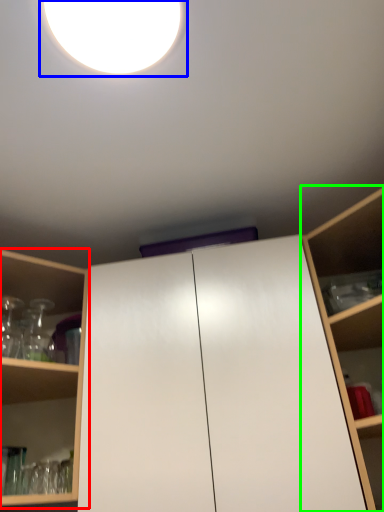
Question: Estimate the real-world distances between objects in this image. Which object is closer to shelf (highlighted by a red box), droplight (highlighted by a blue box) or shelf (highlighted by a green box)?

Choices:
 (A) droplight
 (B) shelf

Answer: (B)